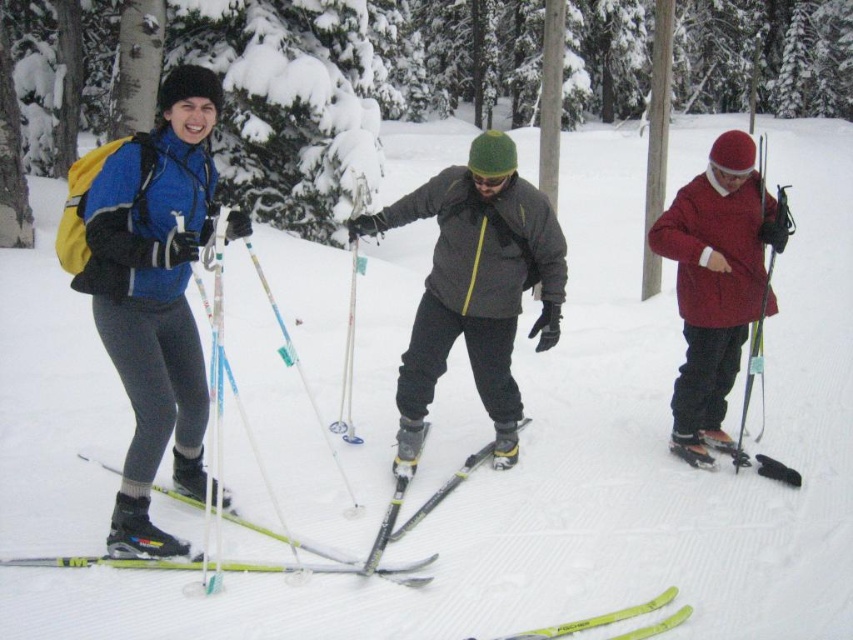
You are planning to rent skis for a day of cross country skiing in this snowy forest. The rental shop has both shiny black ski at center and yellow matte skis at lower center available. You prefer skis that are wider for better stability. Which pair should you choose?

The yellow matte skis at lower center are wider than the shiny black ski at center, so you should choose the yellow matte skis at lower center for better stability.

You are a photographer trying to capture the shiny black ski at center and the yellow matte skis at lower center in a single shot. Based on their positions, which of these skis would appear closer to the camera in the photo?

The yellow matte skis at lower center would appear closer to the camera because they are positioned below the shiny black ski at center, which is located above them.

You are standing at the origin point in the snowy forest scene. There is a shiny black ski at center located at point (418, 508). Can you tell me the exact coordinates of the shiny black ski at center?

The shiny black ski at center is exactly at point (418, 508).